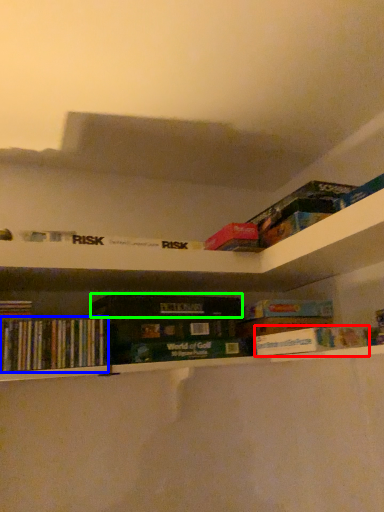
Question: Which is nearer to the book (highlighted by a red box)? book (highlighted by a blue box) or paperback book (highlighted by a green box).

Choices:
 (A) book
 (B) paperback book

Answer: (B)